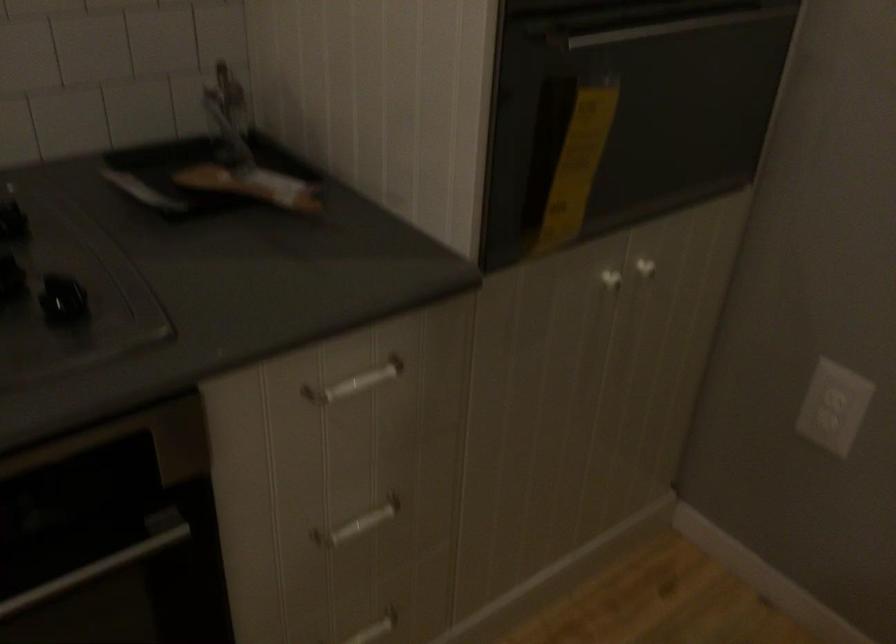
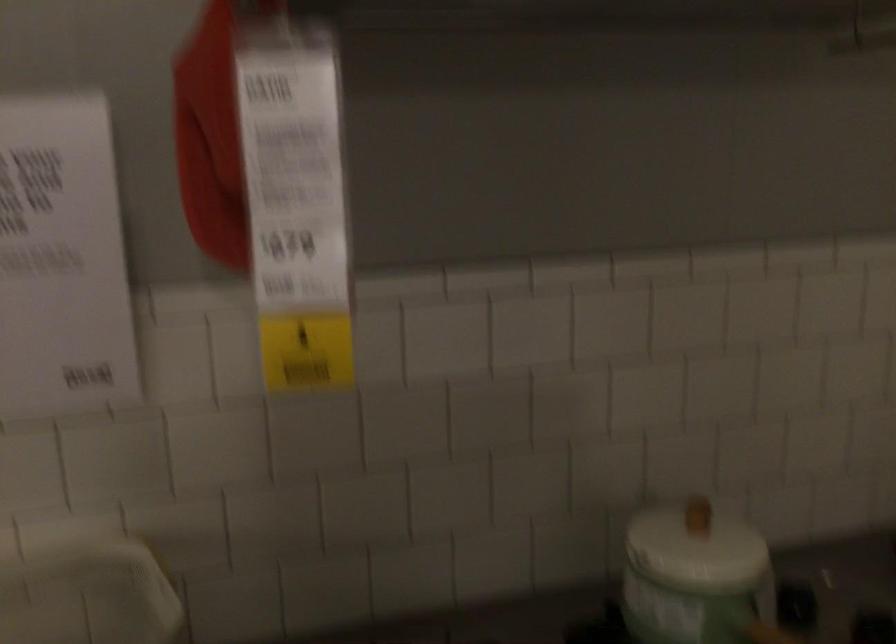
The images are taken continuously from a first-person perspective. In which direction is your viewpoint rotating?

The camera rotated toward left-up.